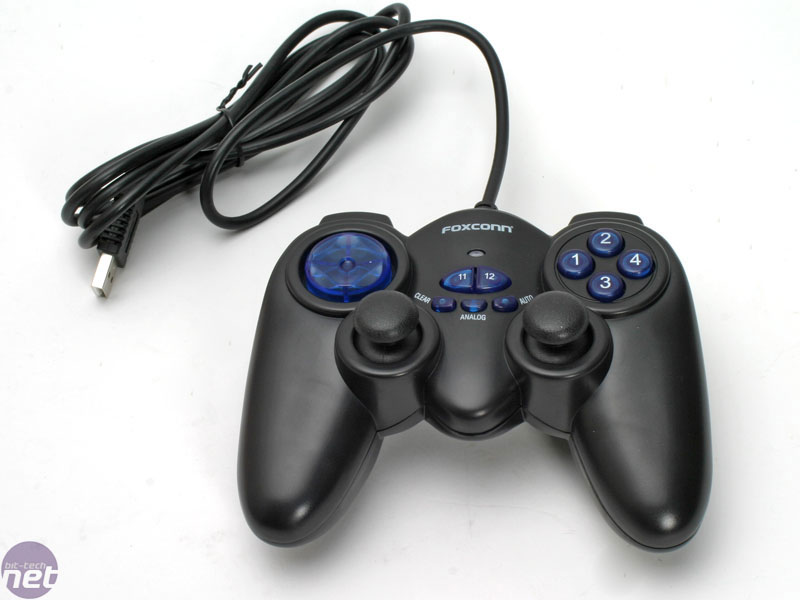
Where is `cord`? cord is located at coordinates (226, 146).